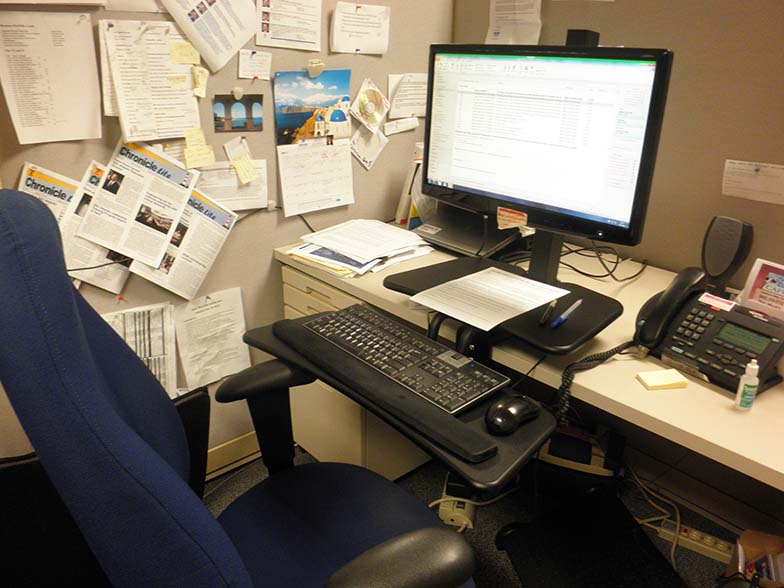
Where is `rug`? rug is located at coordinates (560, 536).